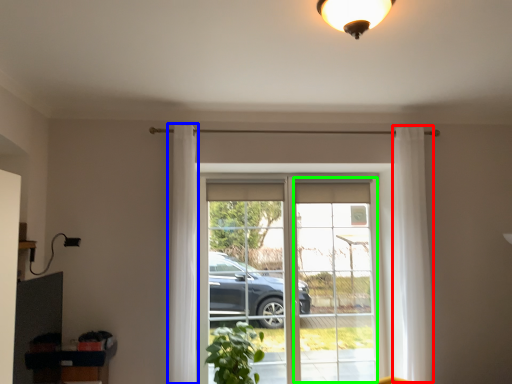
Question: Which is nearer to the curtain (highlighted by a red box)? curtain (highlighted by a blue box) or window frame (highlighted by a green box).

Choices:
 (A) curtain
 (B) window frame

Answer: (B)